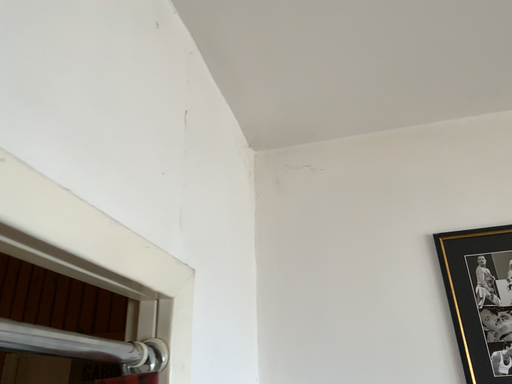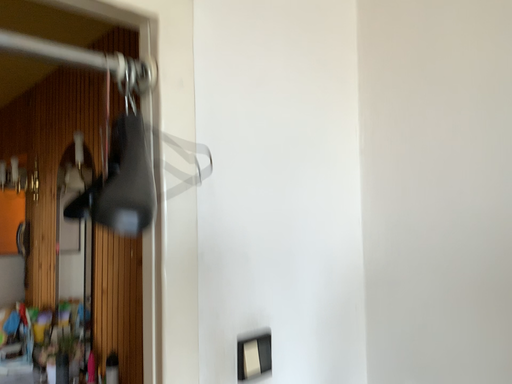
Question: Which way did the camera rotate in the video?

Choices:
 (A) rotated left
 (B) rotated right

Answer: (A)